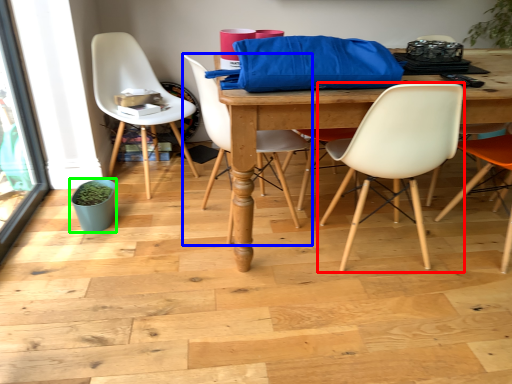
Question: Which object is the farthest from chair (highlighted by a red box)? Choose among these: chair (highlighted by a blue box) or flowerpot (highlighted by a green box).

Choices:
 (A) chair
 (B) flowerpot

Answer: (B)